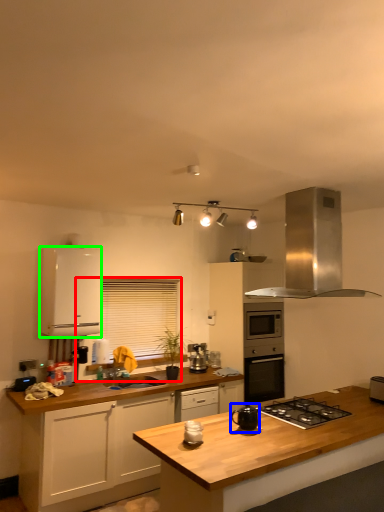
Question: Which object is the farthest from window screen (highlighted by a red box)? Choose among these: kitchen appliance (highlighted by a blue box) or cabinetry (highlighted by a green box).

Choices:
 (A) kitchen appliance
 (B) cabinetry

Answer: (A)